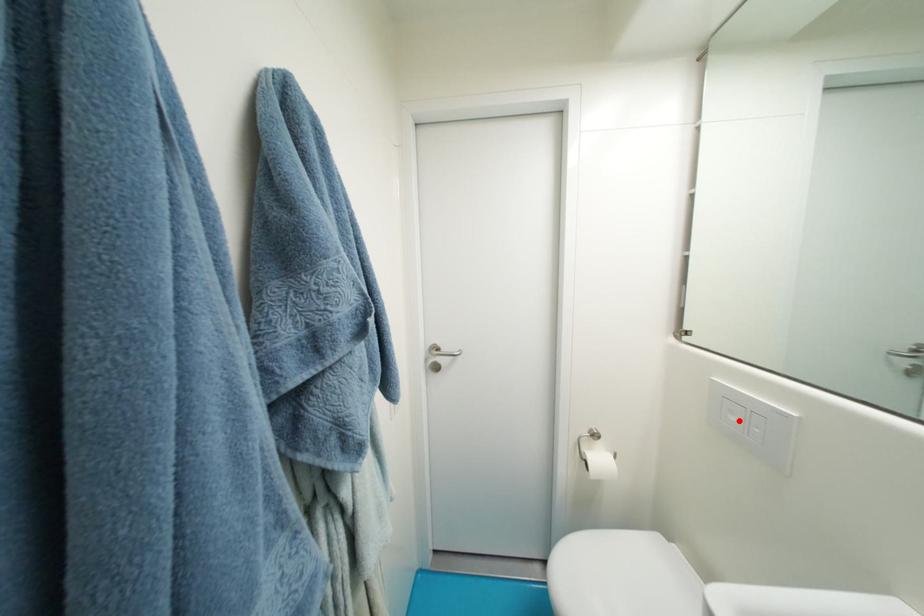
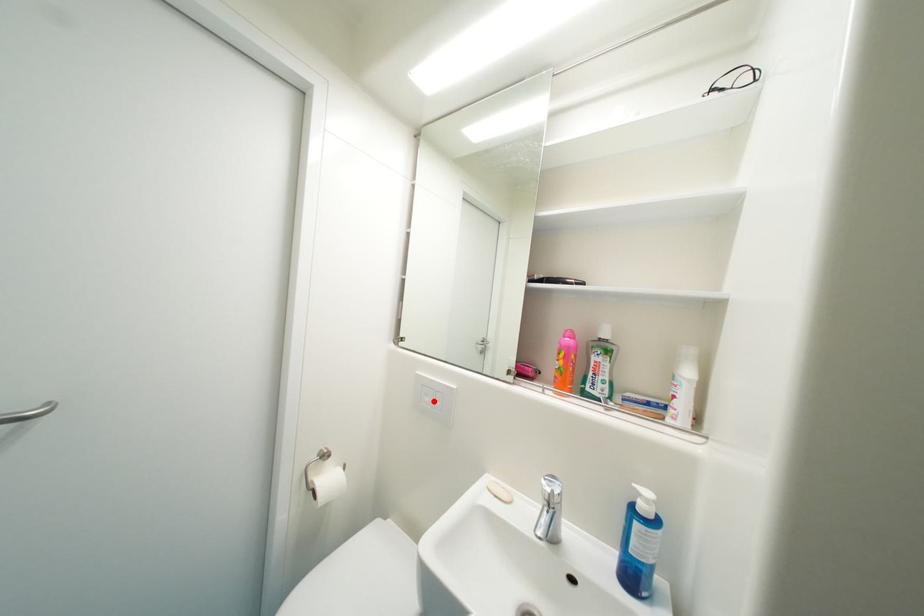
I am providing you with two images of the same scene from different viewpoints. A red point is marked on the first image and another point is marked on the second image. Is the red point in image1 aligned with the point shown in image2?

Yes